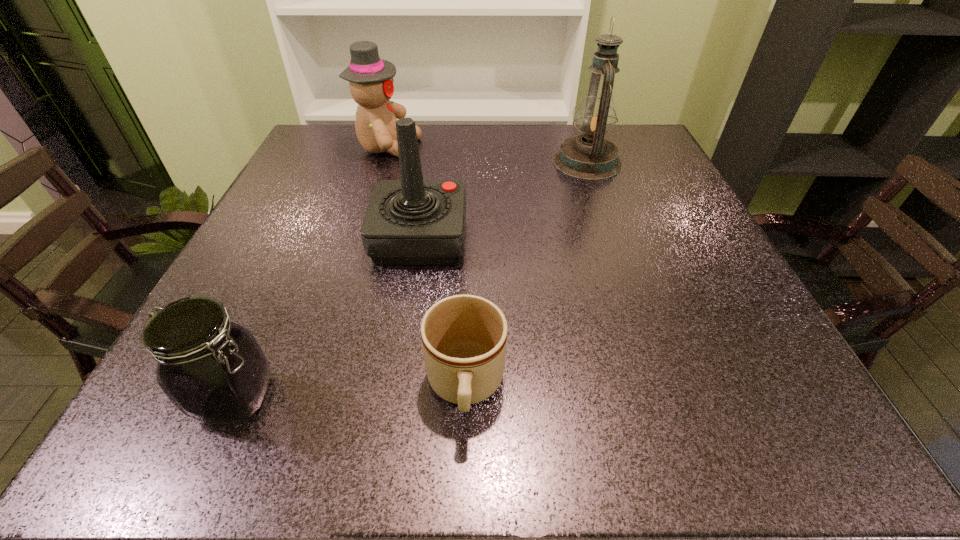
Locate an element on the screen. This screenshot has width=960, height=540. oil lamp at the far edge is located at coordinates (589, 156).

Locate an element on the screen. The height and width of the screenshot is (540, 960). rag_doll present at the far edge is located at coordinates (370, 78).

You are a GUI agent. You are given a task and a screenshot of the screen. Output one action in this format:
    pyautogui.click(x=<x>, y=<y>)
    Task: Click on the jar that is at the near edge
    
    Given the screenshot: What is the action you would take?
    pyautogui.click(x=213, y=370)

In order to click on mug located in the near edge section of the desktop in this screenshot , I will do `click(464, 337)`.

Identify the location of rag_doll located at the left edge. (370, 78).

The width and height of the screenshot is (960, 540). Identify the location of jar at the left edge. (213, 370).

What are the coordinates of `object at the right edge` in the screenshot? It's located at (589, 156).

Find the location of a particular element. object that is at the far left corner is located at coordinates (370, 78).

What are the coordinates of `object at the near left corner` in the screenshot? It's located at (213, 370).

This screenshot has width=960, height=540. Identify the location of object located in the far right corner section of the desktop. tap(589, 156).